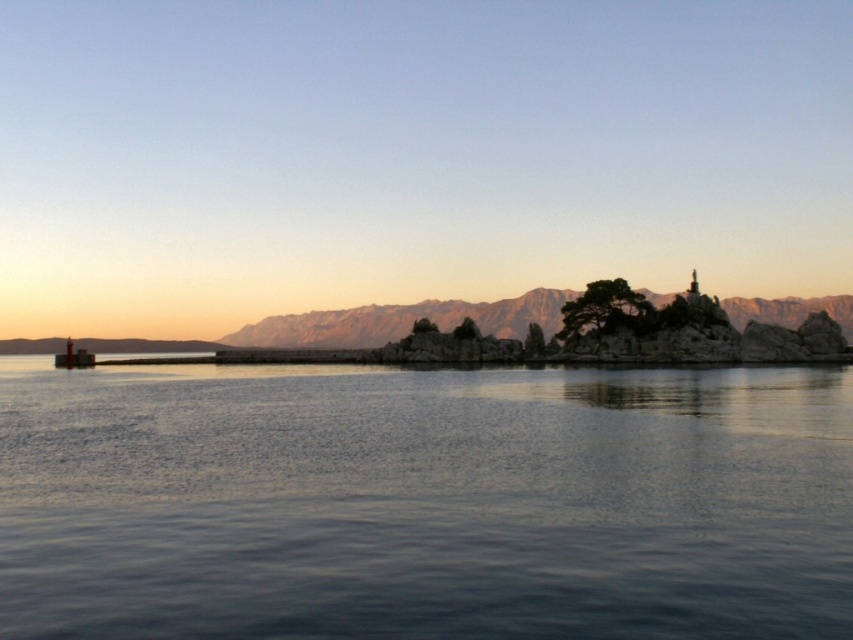
Question: Can you confirm if dark blue water at center is positioned to the right of rocky cliff at center?

Choices:
 (A) no
 (B) yes

Answer: (A)

Question: Which object is farther from the camera taking this photo?

Choices:
 (A) dark blue water at center
 (B) rocky cliff at center

Answer: (B)

Question: Is dark blue water at center above rocky cliff at center?

Choices:
 (A) yes
 (B) no

Answer: (B)

Question: Where is dark blue water at center located in relation to rocky cliff at center in the image?

Choices:
 (A) above
 (B) below

Answer: (B)